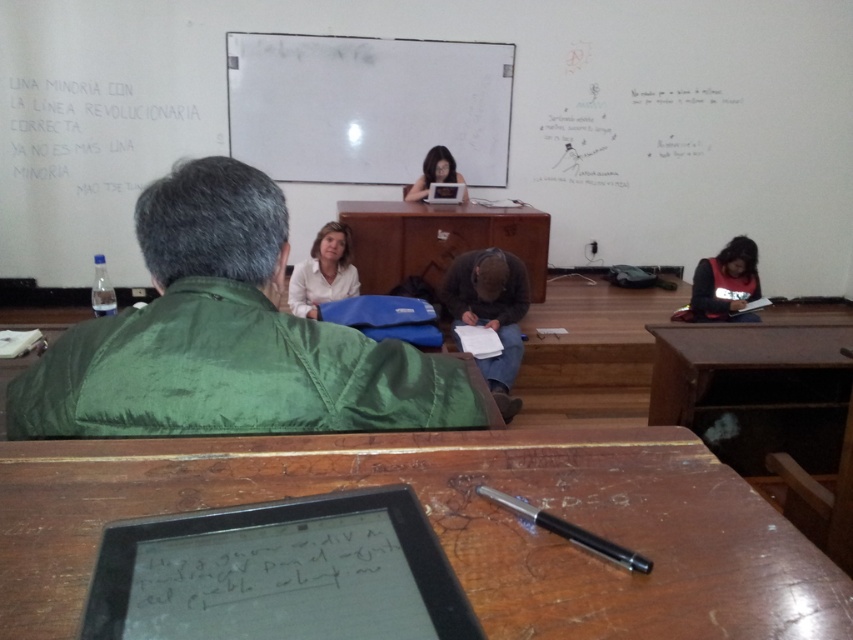
You are a student in the classroom and need to reach both the white matte board at upper center and the black metallic pen at center. Which object should you move towards first if you want to grab the pen before the board?

You should move towards the black metallic pen at center first since it is located to the right of the white matte board at upper center, making it closer if you are approaching from the left side of the scene.

You are a student who needs to borrow the black metallic pen at center from the person wearing the green fabric jacket at lower left. The classroom has a rule that you must not move more than 20 inches away from your seat. Can you safely borrow the pen without breaking the rule?

The distance between the green fabric jacket at lower left and the black metallic pen at center is 19.58 inches, which is under the 20 inches limit. Therefore, you can safely borrow the pen without violating the classroom rule.